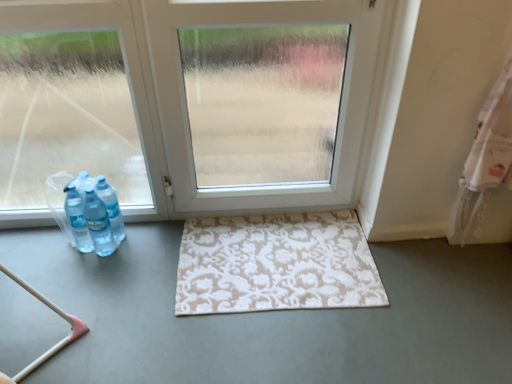
At what (x,y) coordinates should I click in order to perform the action: click on vacant space positioned to the left of white matte door at center. Please return your answer as a coordinate pair (x, y). Looking at the image, I should click on (175, 247).